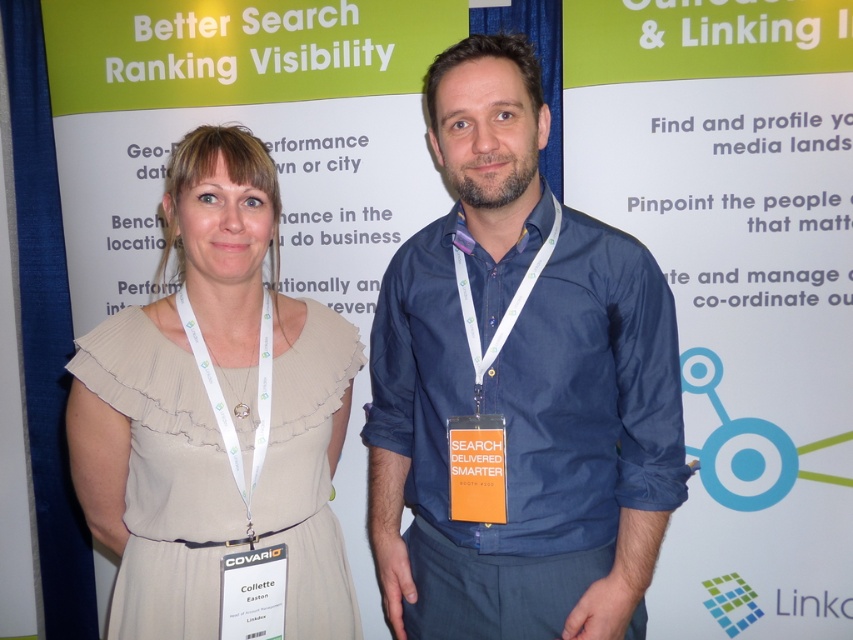
Which is above, blue denim shirt at center or beige chiffon dress at center?

blue denim shirt at center is higher up.

Can you confirm if blue denim shirt at center is wider than beige chiffon dress at center?

Yes, blue denim shirt at center is wider than beige chiffon dress at center.

This screenshot has width=853, height=640. What do you see at coordinates (517, 387) in the screenshot?
I see `blue denim shirt at center` at bounding box center [517, 387].

In order to click on blue denim shirt at center in this screenshot , I will do `click(517, 387)`.